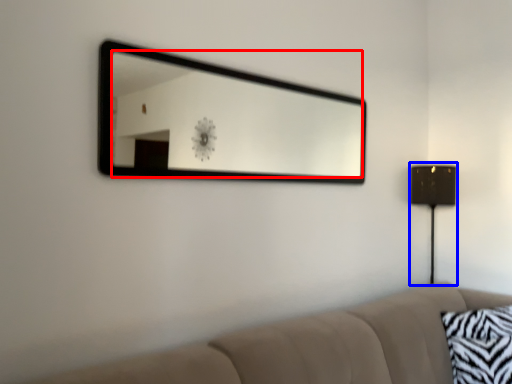
Question: Which object appears closest to the camera in this image, mirror (highlighted by a red box) or table lamp (highlighted by a blue box)?

Choices:
 (A) mirror
 (B) table lamp

Answer: (A)